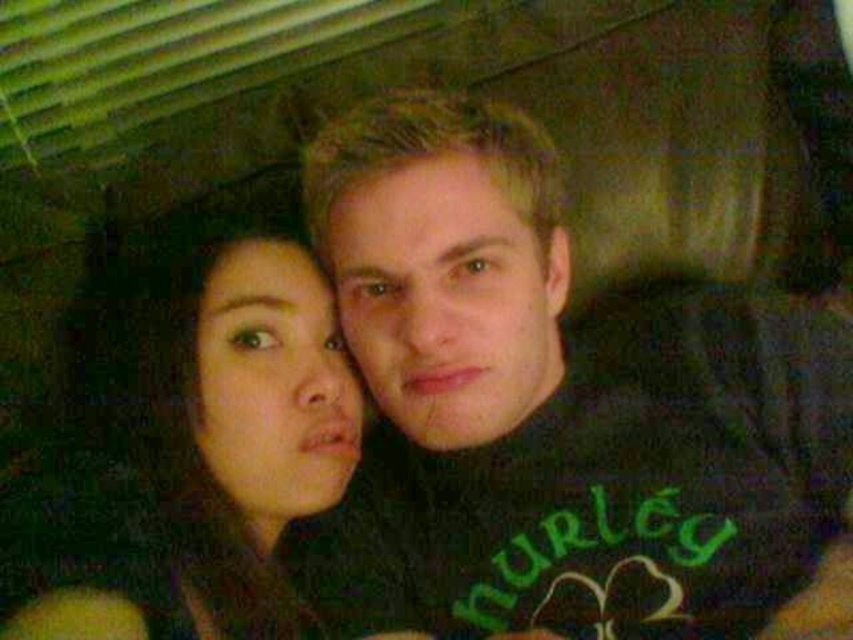
You are a photographer trying to adjust the lighting for a portrait. You notice the matte black shirt at center and the smooth skin face at center in your frame. Which object requires more light to reduce shadows, based on their size in the image?

The matte black shirt at center requires more light because its width is larger than the smooth skin face at center, meaning it may cast deeper shadows that need illumination.

You are a photographer trying to adjust the lighting for a portrait. You notice the matte black shirt at center and the smooth skin face at center. Which object is positioned higher in the frame?

The matte black shirt at center is located above the smooth skin face at center, so it is positioned higher in the frame.

You are a photographer trying to focus on the point at coordinates point (572, 388). According to the scene, where exactly is this point located?

The point (572, 388) is on the matte black shirt at center.